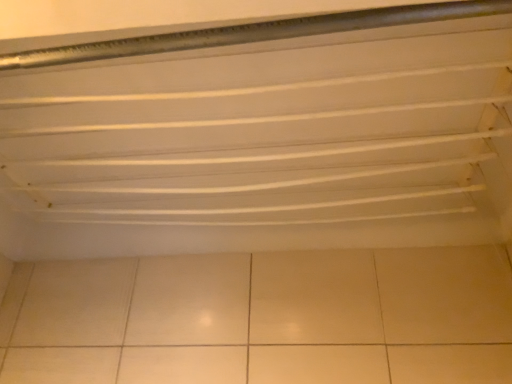
At what (x,y) coordinates should I click in order to perform the action: click on vacant area on top of beige ceramic tile at bottom (from a real-world perspective). Please return your answer as a coordinate pair (x, y). Looking at the image, I should click on (246, 254).